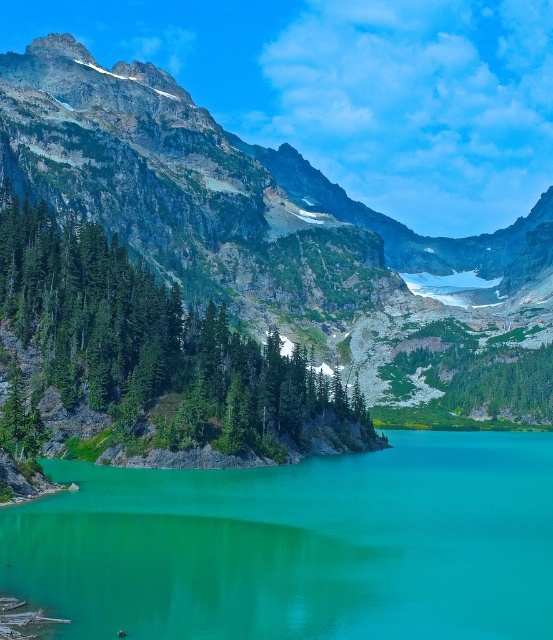
Question: Which object is farther from the camera taking this photo?

Choices:
 (A) turquoise glossy water at center
 (B) rugged granite mountain at upper left

Answer: (B)

Question: Which point is farther to the camera?

Choices:
 (A) rugged granite mountain at upper left
 (B) turquoise glossy water at center

Answer: (A)

Question: Can you confirm if rugged granite mountain at upper left is smaller than turquoise glossy water at center?

Choices:
 (A) no
 (B) yes

Answer: (A)

Question: Does rugged granite mountain at upper left have a smaller size compared to turquoise glossy water at center?

Choices:
 (A) yes
 (B) no

Answer: (B)

Question: Which point appears farthest from the camera in this image?

Choices:
 (A) 321,600
 (B) 239,172

Answer: (B)

Question: Observing the image, what is the correct spatial positioning of rugged granite mountain at upper left in reference to turquoise glossy water at center?

Choices:
 (A) below
 (B) above

Answer: (B)